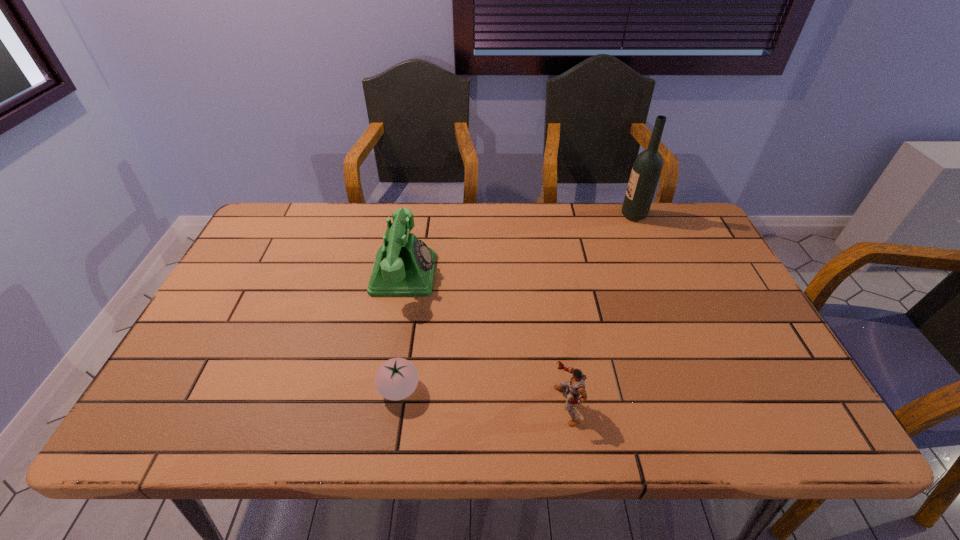
This screenshot has width=960, height=540. In order to click on free spot that satisfies the following two spatial constraints: 1. on the dial of the telephone; 2. on the back side of the shortest object in this screenshot , I will do `click(383, 389)`.

At what (x,y) coordinates should I click in order to perform the action: click on free space that satisfies the following two spatial constraints: 1. on the dial of the third shortest object; 2. on the right side of the shortest object. Please return your answer as a coordinate pair (x, y). This screenshot has height=540, width=960. Looking at the image, I should click on (383, 389).

This screenshot has height=540, width=960. Find the location of `vacant space that satisfies the following two spatial constraints: 1. on the back side of the shortest object; 2. on the dial of the third nearest object`. vacant space that satisfies the following two spatial constraints: 1. on the back side of the shortest object; 2. on the dial of the third nearest object is located at coordinates (417, 274).

Identify the location of vacant space that satisfies the following two spatial constraints: 1. on the dial of the tomato; 2. on the left side of the third nearest object. (383, 389).

This screenshot has height=540, width=960. I want to click on free spot that satisfies the following two spatial constraints: 1. on the dial of the telephone; 2. on the left side of the tomato, so click(x=383, y=389).